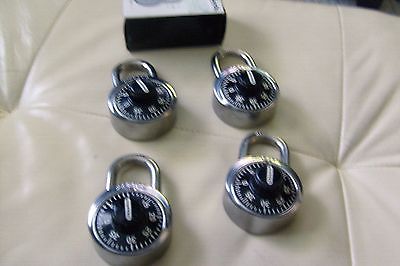
Where is `lines in cushion`? The width and height of the screenshot is (400, 266). lines in cushion is located at coordinates (59, 15), (28, 69), (68, 108), (190, 129), (310, 155), (384, 164), (340, 30), (341, 125), (345, 207), (347, 244).